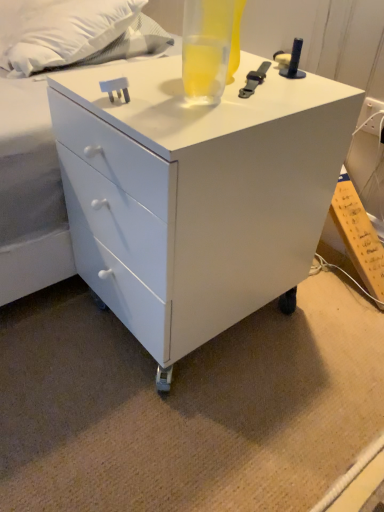
Image resolution: width=384 pixels, height=512 pixels. Find the location of `free area behind translucent glass beverage at top`. free area behind translucent glass beverage at top is located at coordinates 227,70.